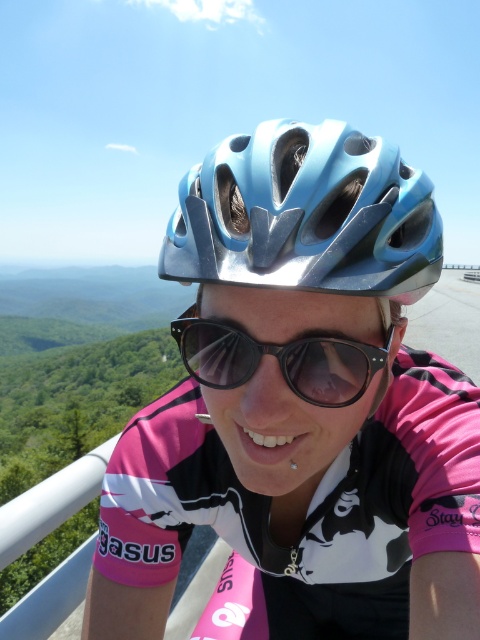
Question: Which of the following is the farthest from the observer?

Choices:
 (A) (295, 189)
 (B) (304, 259)
 (C) (229, 337)

Answer: (C)

Question: Is blue glossy bicycle helmet at center wider than black matte sunglasses at center?

Choices:
 (A) no
 (B) yes

Answer: (B)

Question: Which of the following is the farthest from the observer?

Choices:
 (A) (284, 218)
 (B) (300, 163)

Answer: (B)

Question: Can you confirm if blue glossy bicycle helmet at center is bigger than blue metallic helmet at center?

Choices:
 (A) no
 (B) yes

Answer: (B)

Question: Which point is closer to the camera?

Choices:
 (A) black matte sunglasses at center
 (B) blue glossy bicycle helmet at center

Answer: (B)

Question: In this image, where is blue glossy bicycle helmet at center located relative to blue metallic helmet at center?

Choices:
 (A) above
 (B) below

Answer: (B)